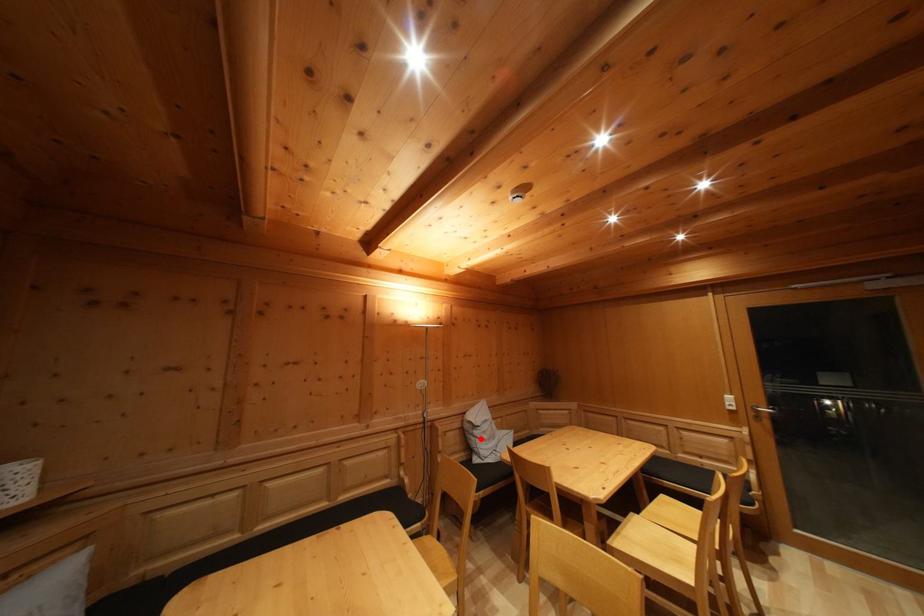
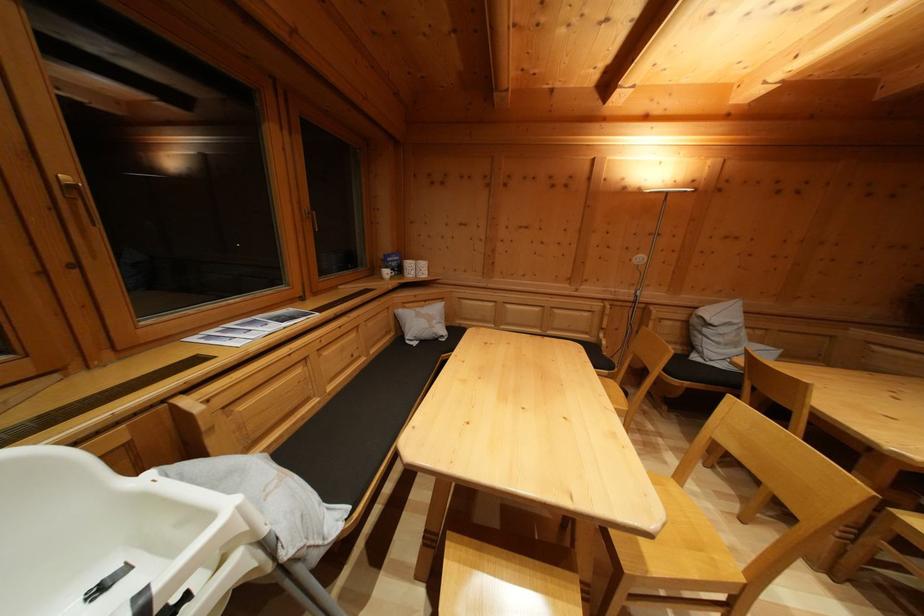
In the second image, find the point that corresponds to the highlighted location in the first image.

(711, 337)